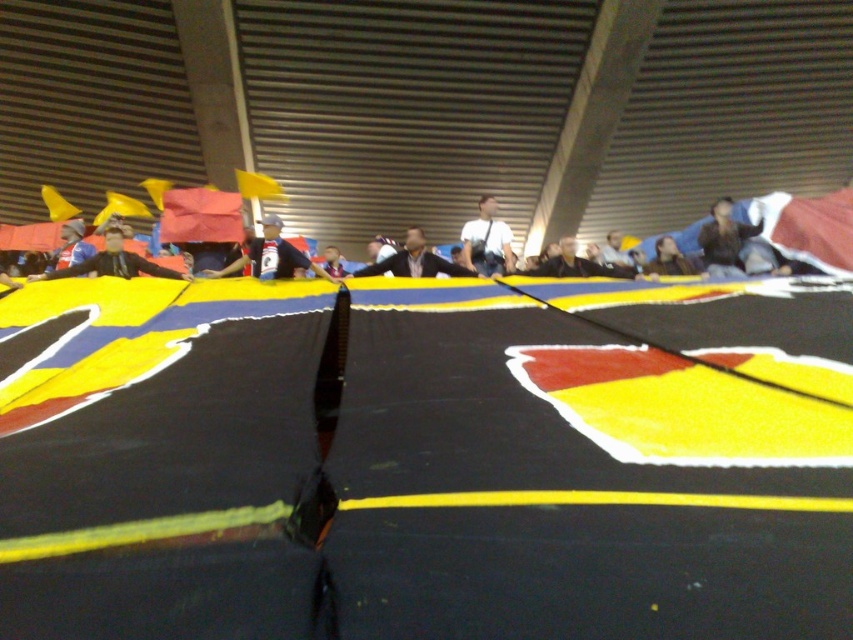
Question: Is white fabric shirt at center bigger than yellow fabric flag at upper center?

Choices:
 (A) no
 (B) yes

Answer: (B)

Question: Is matte black jacket at left smaller than yellow fabric flag at upper center?

Choices:
 (A) no
 (B) yes

Answer: (A)

Question: Can you confirm if matte black jacket at left is bigger than yellow fabric flag at upper center?

Choices:
 (A) no
 (B) yes

Answer: (B)

Question: Among these points, which one is nearest to the camera?

Choices:
 (A) (752, 227)
 (B) (811, 214)
 (C) (515, 372)
 (D) (485, 202)

Answer: (C)

Question: Which object is farther from the camera taking this photo?

Choices:
 (A) yellow fabric flag at upper center
 (B) smooth brown hair at center
 (C) dark blue fabric at upper center

Answer: (A)

Question: Based on their relative distances, which object is nearer to the smooth brown hair at center?

Choices:
 (A) dark blue fabric at upper center
 (B) red fabric flag at upper right
 (C) yellow fabric flag at upper center
 (D) matte black jacket at left

Answer: (A)